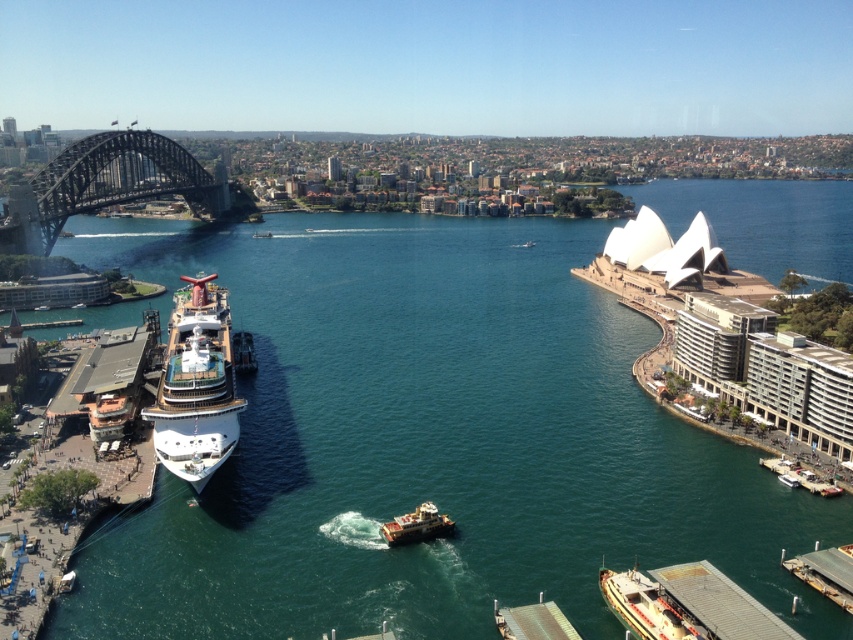
You are a tour guide explaining the distance between landmarks in Sydney Harbour. You mention the green water at center and the dark steel bridge at left. How far apart are these two landmarks?

The green water at center is 109.22 meters away from the dark steel bridge at left.